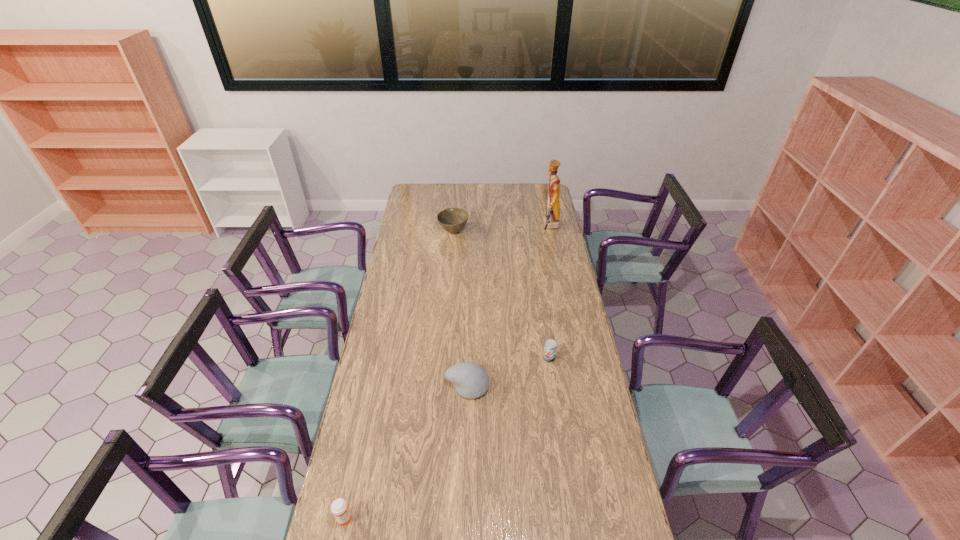
Locate an element on the screen. vacant space located on the front-facing side of the rightmost object is located at coordinates pyautogui.click(x=499, y=227).

Where is `free space located on the left of the bowl`? free space located on the left of the bowl is located at coordinates (412, 232).

Identify the location of free space located on the back of the second nearest object. The width and height of the screenshot is (960, 540). (468, 343).

You are a GUI agent. You are given a task and a screenshot of the screen. Output one action in this format:
    pyautogui.click(x=<x>, y=<y>)
    Task: Click on the free spot located 0.070m on the back of the leftmost object
    This screenshot has height=540, width=960.
    Given the screenshot: What is the action you would take?
    pyautogui.click(x=352, y=488)

Locate an element on the screen. blank space located 0.270m on the left of the third farthest object is located at coordinates (478, 358).

The image size is (960, 540). I want to click on object positioned at the left edge, so click(x=340, y=508).

Locate an element on the screen. nutcracker that is at the right edge is located at coordinates (551, 221).

Identify the location of beer can that is at the right edge. (550, 347).

In the image, there is a desktop. At what (x,y) coordinates should I click in order to perform the action: click on vacant space at the left edge. Please return your answer as a coordinate pair (x, y). The width and height of the screenshot is (960, 540). Looking at the image, I should click on 402,218.

In the image, there is a desktop. Identify the location of vacant area at the right edge. This screenshot has height=540, width=960. (601, 450).